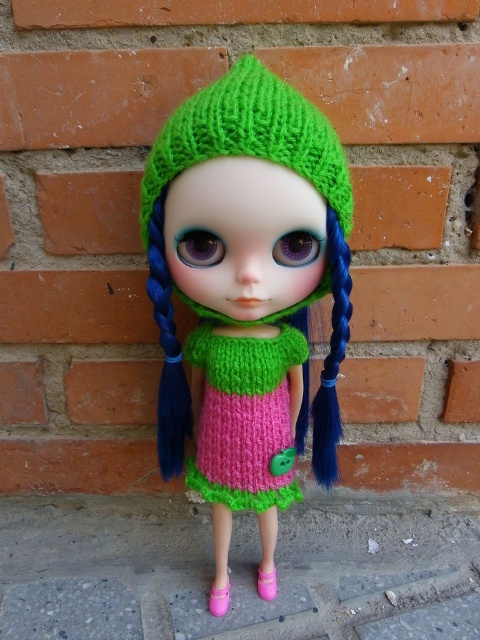
You are an artist sketching the doll and want to place a golden star sticker on its dress. According to the coordinates provided, where should you place the sticker on the pink knitted dress at center?

The golden star sticker should be placed at the coordinates point (x=243, y=417) where the pink knitted dress at center is located.